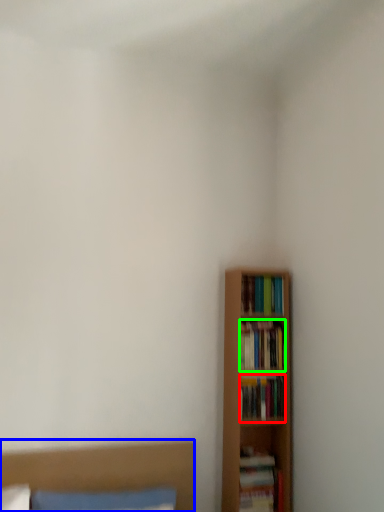
Question: Considering the real-world distances, which object is closest to book (highlighted by a red box)? bed (highlighted by a blue box) or book (highlighted by a green box).

Choices:
 (A) bed
 (B) book

Answer: (B)